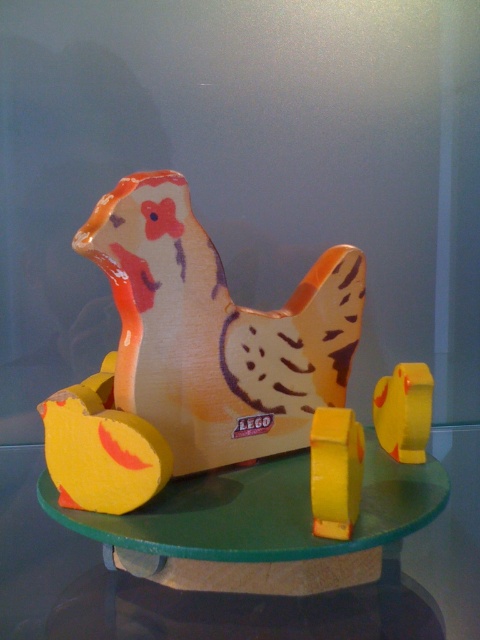
You are looking at the LEGO chicken toy from the front. There are two points marked on it. One is at coordinate point [414,538] and the other is at point [391,380]. Which point is closer to you?

Point [414,538] is closer to the viewer than point [391,380].